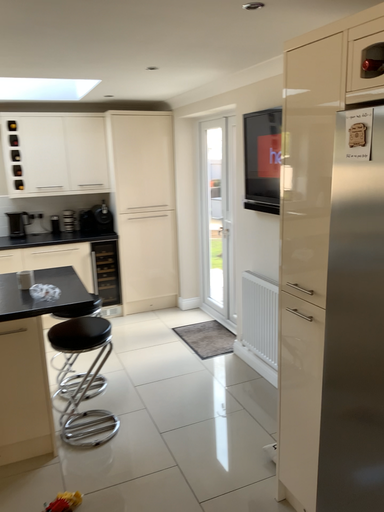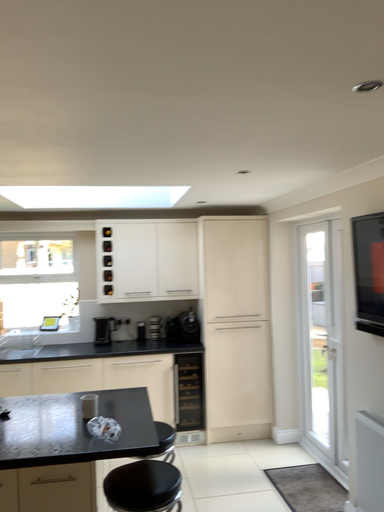
Question: How did the camera likely rotate when shooting the video?

Choices:
 (A) rotated left
 (B) rotated right

Answer: (A)